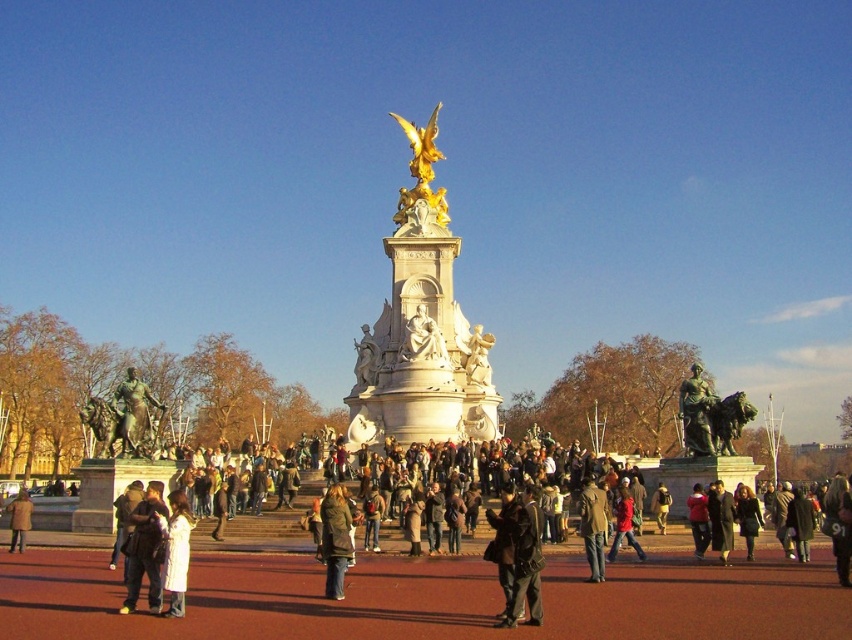
Can you confirm if white marble statue at center is positioned to the left of dark brown leather jacket at lower left?

No, white marble statue at center is not to the left of dark brown leather jacket at lower left.

Which is above, white marble statue at center or dark brown leather jacket at lower left?

white marble statue at center is higher up.

Between point (389, 301) and point (139, 548), which one is positioned behind?

Point (389, 301)

Where is `white marble statue at center`? This screenshot has width=852, height=640. white marble statue at center is located at coordinates (424, 326).

Who is positioned more to the right, bronze statue of man on horse at center or brown leather jacket at center?

Positioned to the right is bronze statue of man on horse at center.

Between point (747, 416) and point (591, 486), which one is positioned in front?

Point (591, 486) is in front.

This screenshot has width=852, height=640. Find the location of `bronze statue of man on horse at center`. bronze statue of man on horse at center is located at coordinates (711, 417).

Does bronze statue at left come behind green textured coat at center?

Yes, bronze statue at left is further from the viewer.

How much distance is there between bronze statue at left and green textured coat at center?

bronze statue at left is 24.57 meters from green textured coat at center.

Does point (114, 417) come behind point (340, 492)?

Yes, point (114, 417) is behind point (340, 492).

The image size is (852, 640). I want to click on bronze statue at left, so click(x=119, y=451).